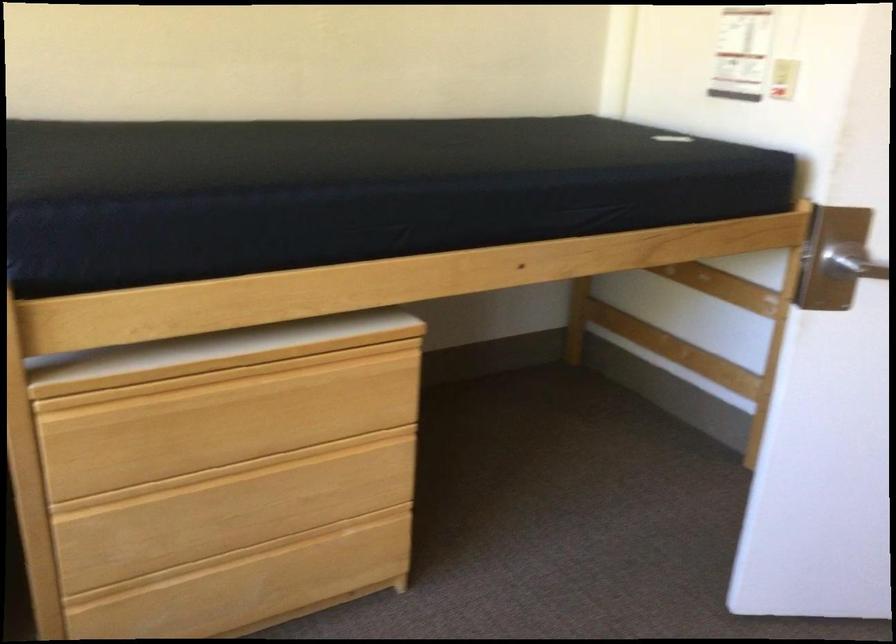
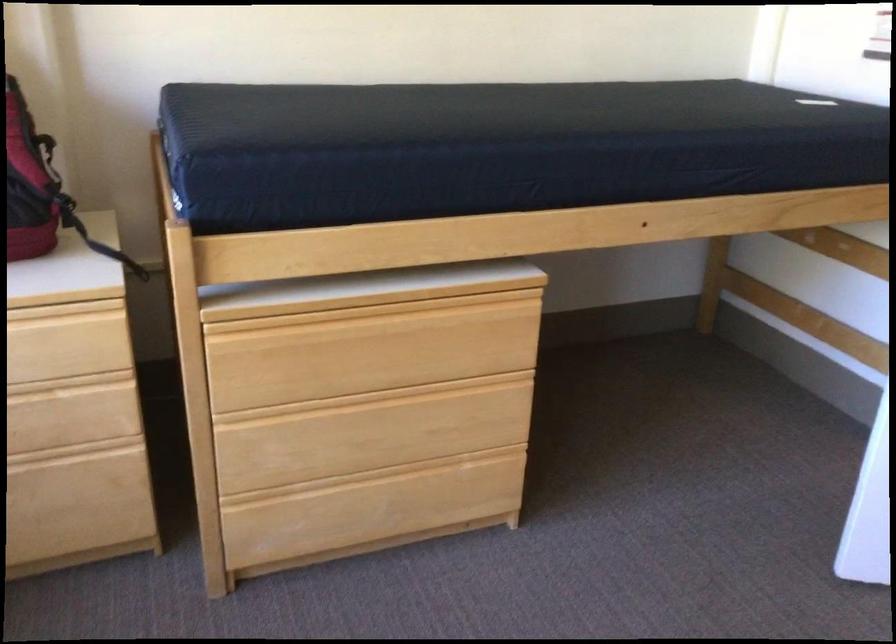
In the second image, find the point that corresponds to (229,422) in the first image.

(369, 353)